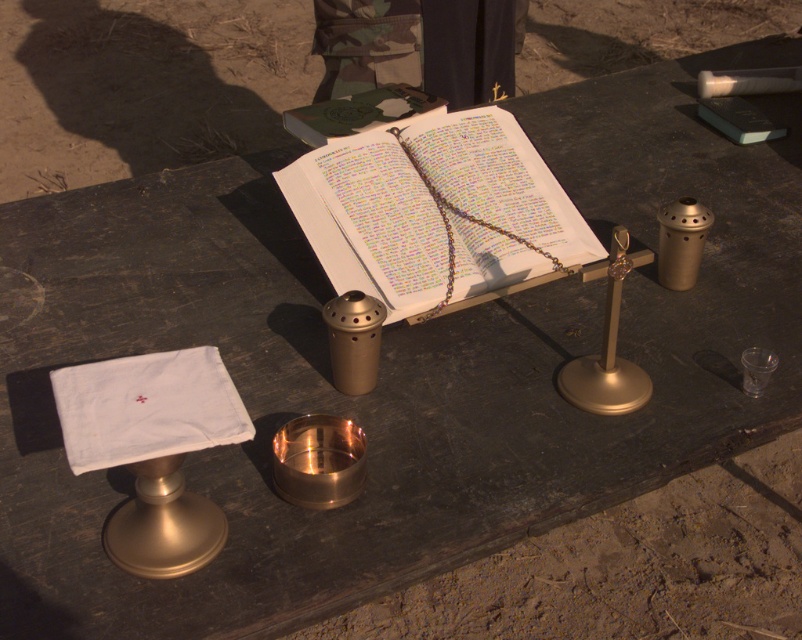
Does white cloth at left lie in front of hardcover book at center?

That is True.

Is white cloth at left to the left of hardcover book at center from the viewer's perspective?

Yes, white cloth at left is to the left of hardcover book at center.

Where is `white cloth at left`? The width and height of the screenshot is (802, 640). white cloth at left is located at coordinates (148, 406).

You are a GUI agent. You are given a task and a screenshot of the screen. Output one action in this format:
    pyautogui.click(x=<x>, y=<y>)
    Task: Click on the white cloth at left
    
    Given the screenshot: What is the action you would take?
    pyautogui.click(x=148, y=406)

Does point (339, 252) come farther from viewer compared to point (200, 369)?

Yes, it is.

Is white paper book at center smaller than white cloth at left?

Actually, white paper book at center might be larger than white cloth at left.

Does point (513, 193) lie behind point (193, 378)?

Yes, it is.

Identify the location of white paper book at center. (x=371, y=221).

Can you confirm if white paper book at center is positioned below hardcover book at center?

Indeed, white paper book at center is positioned under hardcover book at center.

Does point (478, 252) come farther from viewer compared to point (318, 147)?

No, it is not.

At what (x,y) coordinates should I click in order to perform the action: click on white paper book at center. Please return your answer as a coordinate pair (x, y). The height and width of the screenshot is (640, 802). Looking at the image, I should click on (371, 221).